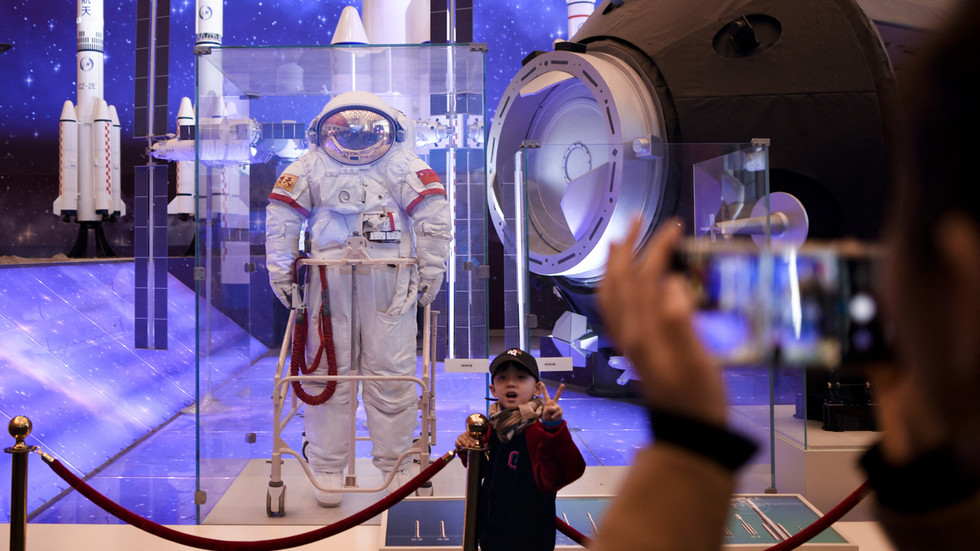
Locate an element on the screen. wallpaper is located at coordinates (59, 78).